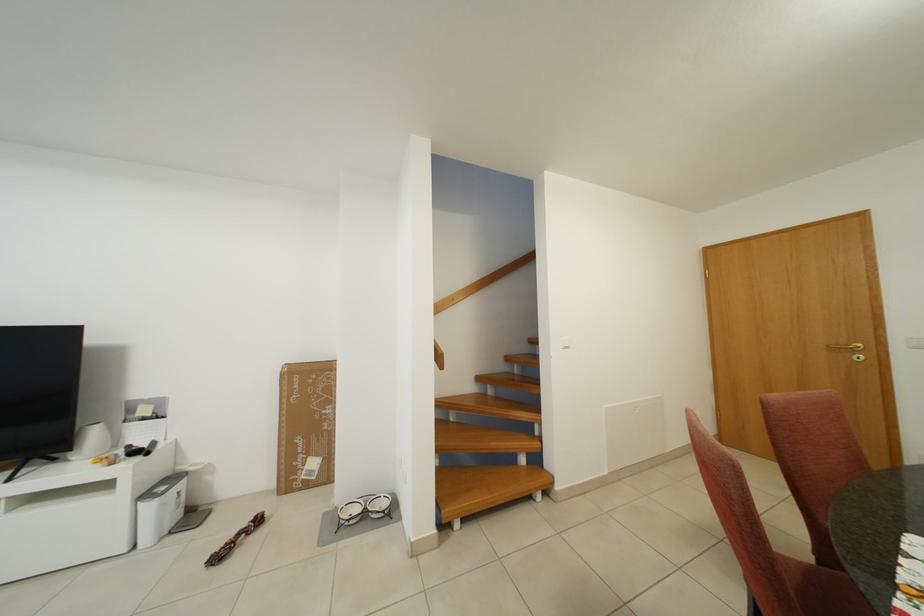
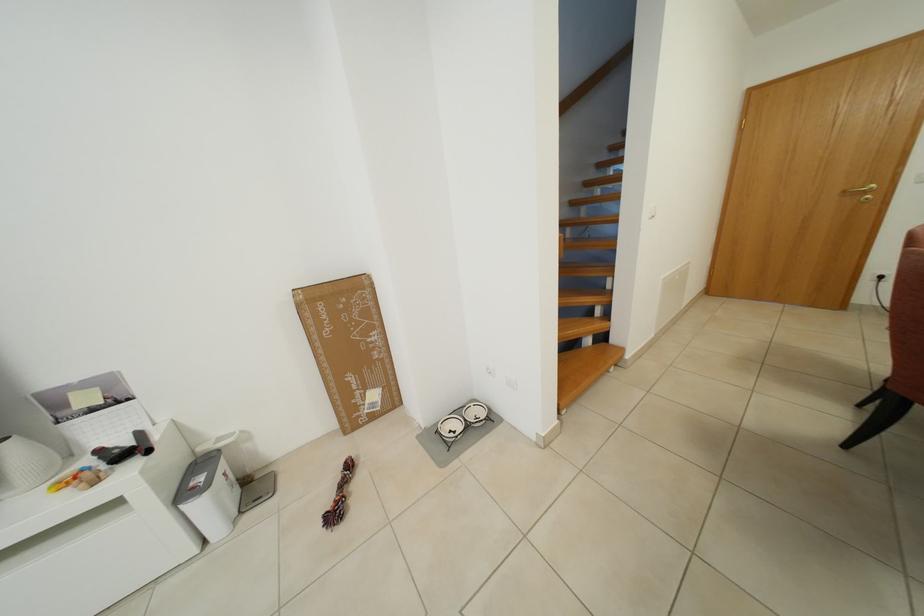
Find the pixel in the second image that matches (120,467) in the first image.

(103, 485)